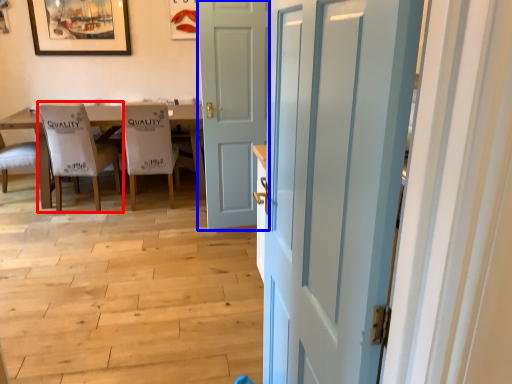
Question: Which object appears closest to the camera in this image, chair (highlighted by a red box) or door (highlighted by a blue box)?

Choices:
 (A) chair
 (B) door

Answer: (B)